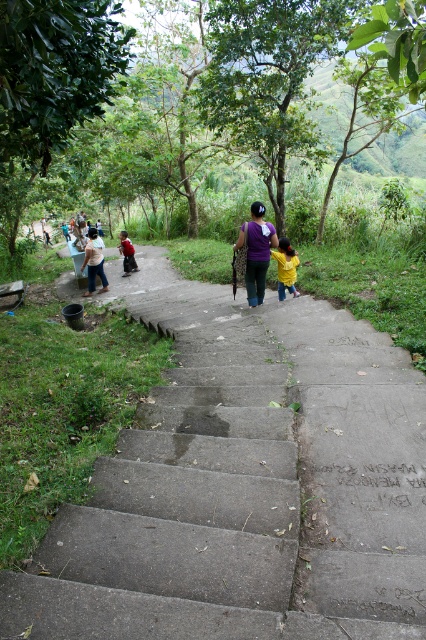
Is yellow matte jacket at center taller than light brown woven bag at left?

No.

Where is `yellow matte jacket at center`? This screenshot has height=640, width=426. yellow matte jacket at center is located at coordinates (285, 268).

Who is positioned more to the right, concrete stairs at center or purple fabric at center?

purple fabric at center is more to the right.

Consider the image. Does concrete stairs at center appear on the left side of purple fabric at center?

Indeed, concrete stairs at center is positioned on the left side of purple fabric at center.

Is point (198, 512) positioned before point (259, 230)?

Yes, it is.

Find the location of `concrete stairs at center`. concrete stairs at center is located at coordinates (178, 509).

Between point (252, 298) and point (132, 269), which one is positioned behind?

The point (132, 269) is behind.

Which of these two, purple fabric at center or red fabric shirt at lower left, stands taller?

With more height is red fabric shirt at lower left.

Is point (270, 237) positioned behind point (126, 234)?

No, (270, 237) is closer to viewer.

You are a GUI agent. You are given a task and a screenshot of the screen. Output one action in this format:
    pyautogui.click(x=<x>, y=<y>)
    Task: Click on the purple fabric at center
    
    Given the screenshot: What is the action you would take?
    [256, 252]